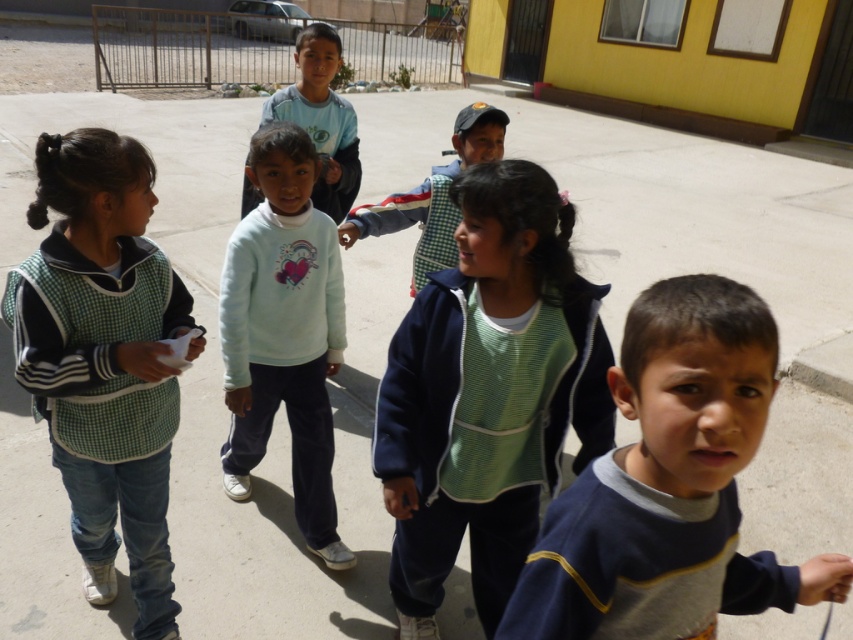
Which of these two, green knit sweater at center or matte blue shirt at center, stands taller?

green knit sweater at center

Describe the element at coordinates (488, 394) in the screenshot. This screenshot has width=853, height=640. I see `green knit sweater at center` at that location.

At what (x,y) coordinates should I click in order to perform the action: click on green knit sweater at center. Please return your answer as a coordinate pair (x, y). The height and width of the screenshot is (640, 853). Looking at the image, I should click on (488, 394).

Does green knit sweater at center have a greater height compared to blue fleece sweater at center?

Correct, green knit sweater at center is much taller as blue fleece sweater at center.

Who is lower down, green knit sweater at center or blue fleece sweater at center?

green knit sweater at center is below.

Is point (602, 291) less distant than point (596, 628)?

No, (602, 291) is further to viewer.

Image resolution: width=853 pixels, height=640 pixels. What are the coordinates of `green knit sweater at center` in the screenshot? It's located at (488, 394).

Does green knit sweater at center have a smaller size compared to green checkered vest at left?

Yes, green knit sweater at center is smaller than green checkered vest at left.

Does green knit sweater at center have a lesser width compared to green checkered vest at left?

Correct, green knit sweater at center's width is less than green checkered vest at left's.

Image resolution: width=853 pixels, height=640 pixels. Identify the location of green knit sweater at center. (488, 394).

You are a GUI agent. You are given a task and a screenshot of the screen. Output one action in this format:
    pyautogui.click(x=<x>, y=<y>)
    Task: Click on the green knit sweater at center
    The height and width of the screenshot is (640, 853).
    Given the screenshot: What is the action you would take?
    pyautogui.click(x=488, y=394)